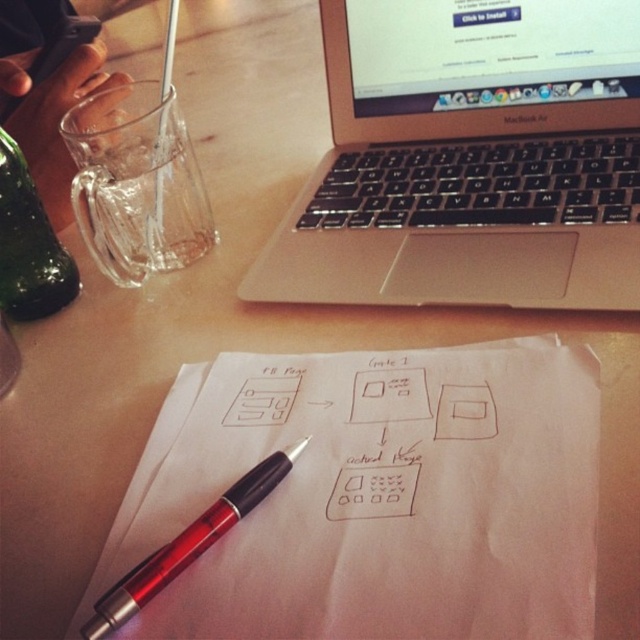
Question: Does matte paper notepad at center have a greater width compared to silver metallic laptop at upper center?

Choices:
 (A) yes
 (B) no

Answer: (B)

Question: Which point is farther from the camera taking this photo?

Choices:
 (A) (276, 481)
 (B) (634, 1)

Answer: (B)

Question: Which point is closer to the camera?

Choices:
 (A) silver metallic laptop at upper center
 (B) translucent red pen at center
 (C) matte paper notepad at center
 (D) green glass bottle at left

Answer: (C)

Question: Does silver metallic laptop at upper center appear on the right side of translucent red pen at center?

Choices:
 (A) yes
 (B) no

Answer: (A)

Question: Is silver metallic laptop at upper center bigger than green glass bottle at left?

Choices:
 (A) no
 (B) yes

Answer: (B)

Question: Which point is farther to the camera?

Choices:
 (A) (515, 566)
 (B) (422, 26)
 (C) (42, 220)

Answer: (B)